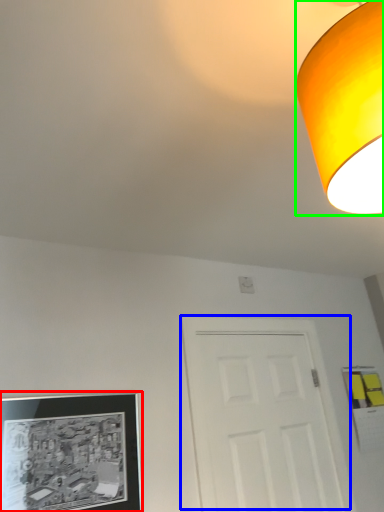
Question: Which object is the farthest from picture frame (highlighted by a red box)? Choose among these: door (highlighted by a blue box) or lamp (highlighted by a green box).

Choices:
 (A) door
 (B) lamp

Answer: (B)